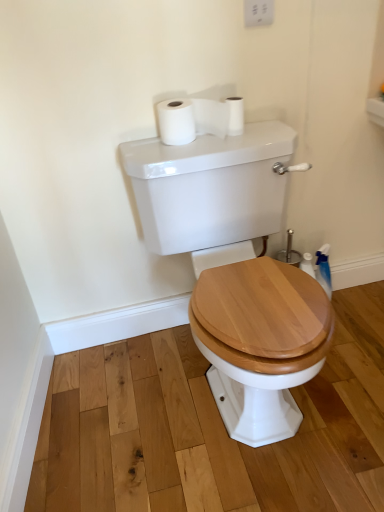
Question: Is white glossy porcelain at center with white matte toilet paper at upper center, which is the first toilet paper from left to right?

Choices:
 (A) no
 (B) yes

Answer: (A)

Question: Is white glossy porcelain at center behind white matte toilet paper at upper center, which is the first toilet paper from left to right?

Choices:
 (A) yes
 (B) no

Answer: (B)

Question: Can white matte toilet paper at upper center, which is the first toilet paper from left to right, be found inside white glossy porcelain at center?

Choices:
 (A) no
 (B) yes

Answer: (A)

Question: Can you confirm if white glossy porcelain at center is positioned to the right of white matte toilet paper at upper center, the second toilet paper in the right-to-left sequence?

Choices:
 (A) yes
 (B) no

Answer: (A)

Question: From the image's perspective, is white glossy porcelain at center above white matte toilet paper at upper center, which is the first toilet paper from left to right?

Choices:
 (A) yes
 (B) no

Answer: (B)

Question: From a real-world perspective, is white glossy porcelain at center under white matte toilet paper at upper center, the second toilet paper in the right-to-left sequence?

Choices:
 (A) yes
 (B) no

Answer: (A)

Question: Is white matte toilet paper at upper center, the second toilet paper in the right-to-left sequence, taller than white glossy porcelain at center?

Choices:
 (A) yes
 (B) no

Answer: (B)

Question: Is white matte toilet paper at upper center, the second toilet paper in the right-to-left sequence, touching white glossy porcelain at center?

Choices:
 (A) no
 (B) yes

Answer: (A)

Question: Is white glossy porcelain at center completely or partially inside white matte toilet paper at upper center, the second toilet paper in the right-to-left sequence?

Choices:
 (A) no
 (B) yes

Answer: (A)

Question: From the image's perspective, is white matte toilet paper at upper center, the second toilet paper in the right-to-left sequence, below white glossy porcelain at center?

Choices:
 (A) no
 (B) yes

Answer: (A)

Question: Considering the relative sizes of white matte toilet paper at upper center, the second toilet paper in the right-to-left sequence, and white glossy porcelain at center in the image provided, is white matte toilet paper at upper center, the second toilet paper in the right-to-left sequence, wider than white glossy porcelain at center?

Choices:
 (A) no
 (B) yes

Answer: (A)

Question: Is white matte toilet paper at upper center, the second toilet paper in the right-to-left sequence, smaller than white glossy porcelain at center?

Choices:
 (A) no
 (B) yes

Answer: (B)

Question: Is white plastic switch at upper center far away from white matte toilet paper at upper center, which ranks as the second toilet paper in left-to-right order?

Choices:
 (A) no
 (B) yes

Answer: (A)